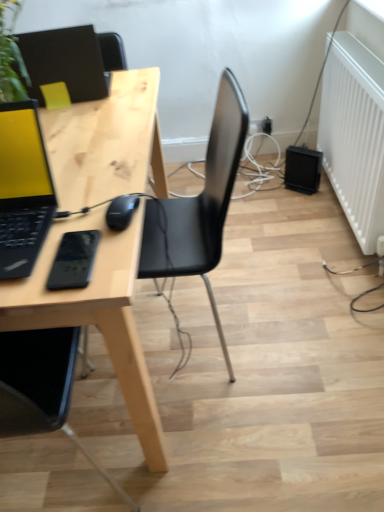
Question: Considering the relative sizes of black matte mouse at center and matte black laptop at left, acting as the 2th laptop starting from the back, in the image provided, is black matte mouse at center wider than matte black laptop at left, acting as the 2th laptop starting from the back,?

Choices:
 (A) yes
 (B) no

Answer: (B)

Question: From a real-world perspective, is black matte mouse at center under matte black laptop at left, acting as the 2th laptop starting from the back?

Choices:
 (A) yes
 (B) no

Answer: (A)

Question: From the image's perspective, is black matte mouse at center beneath matte black laptop at left, acting as the 2th laptop starting from the top?

Choices:
 (A) yes
 (B) no

Answer: (A)

Question: Is black matte mouse at center positioned behind matte black laptop at left, which appears as the first laptop when viewed from the front?

Choices:
 (A) yes
 (B) no

Answer: (A)

Question: Considering the relative sizes of black matte mouse at center and matte black laptop at left, which appears as the first laptop when viewed from the front, in the image provided, is black matte mouse at center shorter than matte black laptop at left, which appears as the first laptop when viewed from the front,?

Choices:
 (A) yes
 (B) no

Answer: (A)

Question: Considering the positions of black plastic electric outlet at lower right and matte black laptop at upper left, the second laptop in the front-to-back sequence, in the image, is black plastic electric outlet at lower right wider or thinner than matte black laptop at upper left, the second laptop in the front-to-back sequence,?

Choices:
 (A) thin
 (B) wide

Answer: (A)

Question: Based on their sizes in the image, would you say black plastic electric outlet at lower right is bigger or smaller than matte black laptop at upper left, placed as the second laptop when sorted from bottom to top?

Choices:
 (A) big
 (B) small

Answer: (B)

Question: From the image's perspective, is black plastic electric outlet at lower right positioned above or below matte black laptop at upper left, which ranks as the 1th laptop in top-to-bottom order?

Choices:
 (A) above
 (B) below

Answer: (A)

Question: Considering their positions, is black plastic electric outlet at lower right located in front of or behind matte black laptop at upper left, which ranks as the 1th laptop in top-to-bottom order?

Choices:
 (A) front
 (B) behind

Answer: (B)

Question: Considering the relative positions of matte black laptop at left, placed as the first laptop when sorted from bottom to top, and light wood desk at center in the image provided, is matte black laptop at left, placed as the first laptop when sorted from bottom to top, to the left or to the right of light wood desk at center?

Choices:
 (A) left
 (B) right

Answer: (B)

Question: Is matte black laptop at left, acting as the 2th laptop starting from the back, inside or outside of light wood desk at center?

Choices:
 (A) inside
 (B) outside

Answer: (B)

Question: In the image, is matte black laptop at left, acting as the 2th laptop starting from the back, positioned in front of or behind light wood desk at center?

Choices:
 (A) behind
 (B) front

Answer: (B)

Question: From the image's perspective, is matte black laptop at left, which appears as the first laptop when viewed from the front, above or below light wood desk at center?

Choices:
 (A) above
 (B) below

Answer: (A)

Question: From a real-world perspective, is white matte radiator at right positioned above or below black matte mouse at center?

Choices:
 (A) below
 (B) above

Answer: (A)

Question: Is white matte radiator at right in front of or behind black matte mouse at center in the image?

Choices:
 (A) front
 (B) behind

Answer: (B)